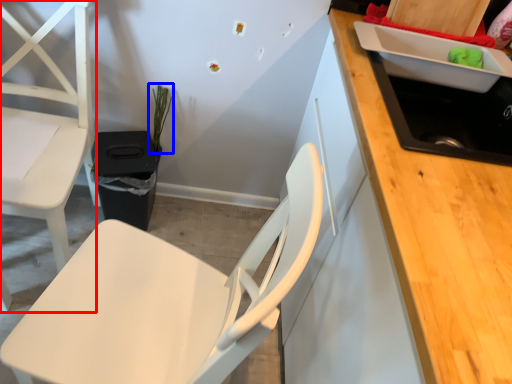
Question: Which object appears closest to the camera in this image, chair (highlighted by a red box) or plant (highlighted by a blue box)?

Choices:
 (A) chair
 (B) plant

Answer: (A)